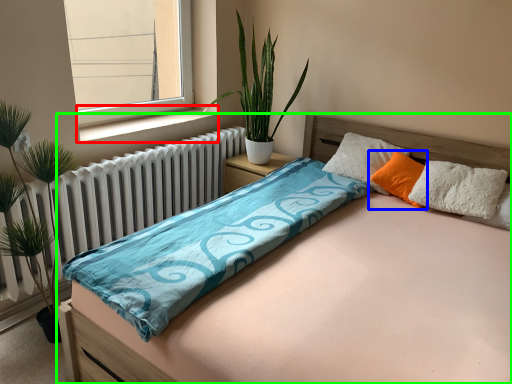
Question: Which object is the closest to the window sill (highlighted by a red box)? Choose among these: pillow (highlighted by a blue box) or bed (highlighted by a green box).

Choices:
 (A) pillow
 (B) bed

Answer: (A)